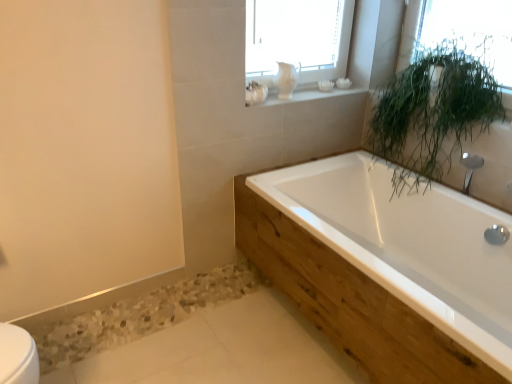
Question: Is there a large distance between white ceramic objects at upper center and green leafy plant at upper right?

Choices:
 (A) yes
 (B) no

Answer: (B)

Question: Is white ceramic objects at upper center facing away from green leafy plant at upper right?

Choices:
 (A) no
 (B) yes

Answer: (A)

Question: From the image's perspective, is white ceramic objects at upper center beneath green leafy plant at upper right?

Choices:
 (A) yes
 (B) no

Answer: (A)

Question: Considering the relative sizes of white ceramic objects at upper center and green leafy plant at upper right in the image provided, is white ceramic objects at upper center smaller than green leafy plant at upper right?

Choices:
 (A) no
 (B) yes

Answer: (B)

Question: Is white ceramic objects at upper center positioned in front of green leafy plant at upper right?

Choices:
 (A) yes
 (B) no

Answer: (B)

Question: Considering the positions of white glossy bathtub at center and green leafy plant at upper right in the image, is white glossy bathtub at center wider or thinner than green leafy plant at upper right?

Choices:
 (A) thin
 (B) wide

Answer: (B)

Question: Choose the correct answer: Is white glossy bathtub at center inside green leafy plant at upper right or outside it?

Choices:
 (A) inside
 (B) outside

Answer: (B)

Question: Visually, is white glossy bathtub at center positioned to the left or to the right of green leafy plant at upper right?

Choices:
 (A) right
 (B) left

Answer: (B)

Question: In the image, is white glossy bathtub at center positioned in front of or behind green leafy plant at upper right?

Choices:
 (A) front
 (B) behind

Answer: (A)

Question: In the image, is green leafy plant at upper right positioned in front of or behind green leafy plant at upper right?

Choices:
 (A) front
 (B) behind

Answer: (A)

Question: Is green leafy plant at upper right to the left or to the right of green leafy plant at upper right in the image?

Choices:
 (A) left
 (B) right

Answer: (A)

Question: Considering the positions of green leafy plant at upper right and green leafy plant at upper right in the image, is green leafy plant at upper right taller or shorter than green leafy plant at upper right?

Choices:
 (A) short
 (B) tall

Answer: (B)

Question: From a real-world perspective, is green leafy plant at upper right physically located above or below green leafy plant at upper right?

Choices:
 (A) above
 (B) below

Answer: (B)

Question: From the image's perspective, is white ceramic objects at upper center above or below green leafy plant at upper right?

Choices:
 (A) below
 (B) above

Answer: (A)

Question: Is white ceramic objects at upper center to the left or to the right of green leafy plant at upper right in the image?

Choices:
 (A) left
 (B) right

Answer: (A)